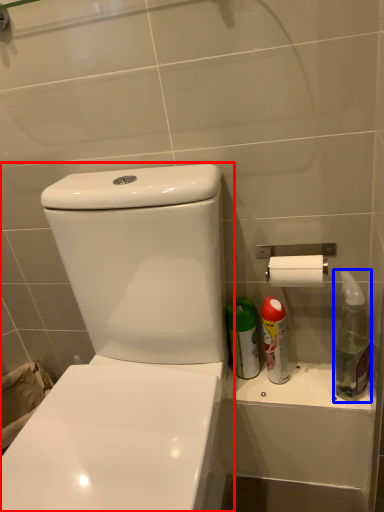
Question: Which object appears closest to the camera in this image, toilet (highlighted by a red box) or cleaning product (highlighted by a blue box)?

Choices:
 (A) toilet
 (B) cleaning product

Answer: (A)